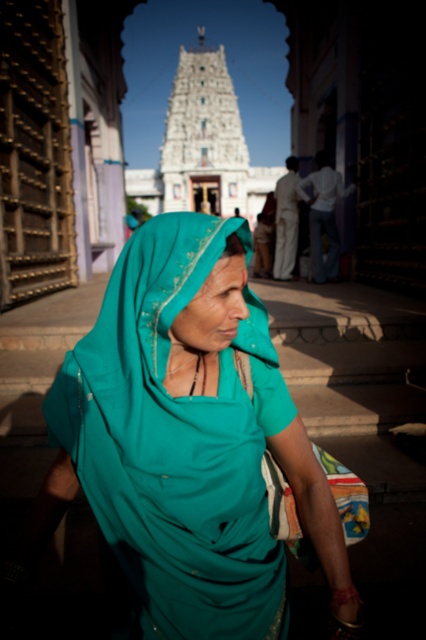
Is teal fabric headscarf at center closer to camera compared to light brown cotton robe at center?

Yes, teal fabric headscarf at center is closer to the viewer.

Is teal fabric headscarf at center taller than light brown cotton robe at center?

Yes, teal fabric headscarf at center is taller than light brown cotton robe at center.

I want to click on teal fabric headscarf at center, so click(x=192, y=438).

Locate an element on the screen. teal fabric headscarf at center is located at coordinates (192, 438).